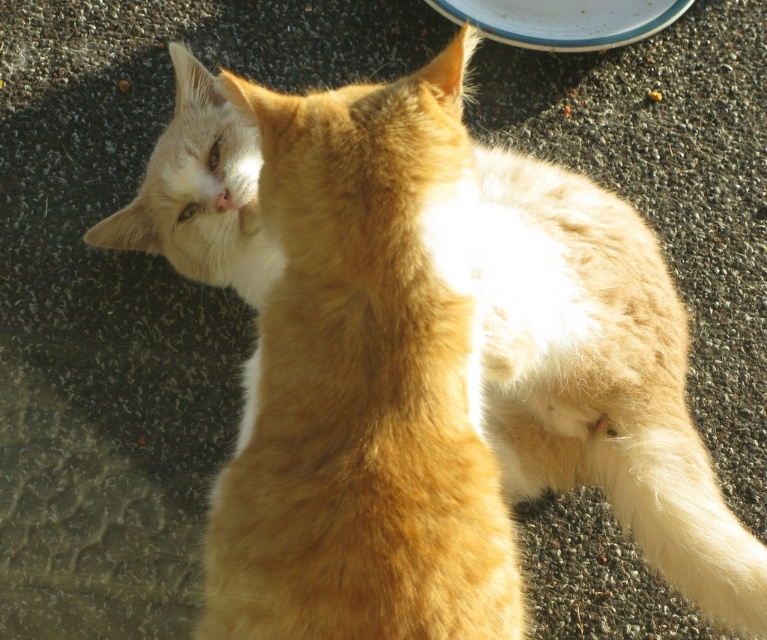
Is white fluffy tail at lower right bigger than white glossy plate at upper center?

Yes, white fluffy tail at lower right is bigger than white glossy plate at upper center.

Identify the location of white fluffy tail at lower right. The image size is (767, 640). (680, 518).

The height and width of the screenshot is (640, 767). What do you see at coordinates (680, 518) in the screenshot? I see `white fluffy tail at lower right` at bounding box center [680, 518].

This screenshot has width=767, height=640. I want to click on white fluffy tail at lower right, so click(680, 518).